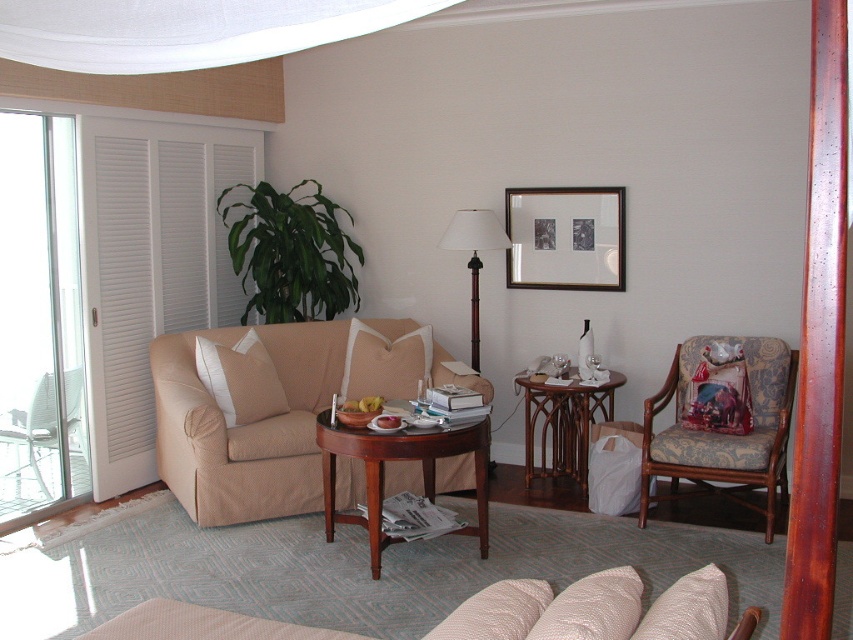
From the picture: Does transparent glass door at left come behind woodenside table at right?

No, transparent glass door at left is closer to the viewer.

What do you see at coordinates (39, 321) in the screenshot? I see `transparent glass door at left` at bounding box center [39, 321].

This screenshot has height=640, width=853. What are the coordinates of `transparent glass door at left` in the screenshot? It's located at (39, 321).

Based on the photo, is beige fabric pillow at center wider than beige fabric armchair at left?

Incorrect, beige fabric pillow at center's width does not surpass beige fabric armchair at left's.

Is beige fabric pillow at center to the right of beige fabric armchair at left from the viewer's perspective?

Correct, you'll find beige fabric pillow at center to the right of beige fabric armchair at left.

Looking at this image, who is more forward, (357, 349) or (13, 442)?

Positioned in front is point (357, 349).

The width and height of the screenshot is (853, 640). Identify the location of beige fabric pillow at center. (386, 362).

Between beige fabric couch at center and beige fabric couch at lower center, which one has less height?

beige fabric couch at lower center is shorter.

Which is in front, point (315, 394) or point (463, 625)?

Point (463, 625)

Image resolution: width=853 pixels, height=640 pixels. What are the coordinates of `beige fabric couch at center` in the screenshot? It's located at (245, 424).

Locate an element on the screen. The width and height of the screenshot is (853, 640). beige fabric couch at center is located at coordinates (245, 424).